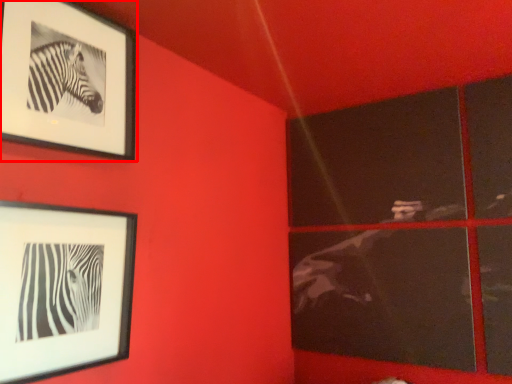
Question: From the image's perspective, what is the correct spatial positioning of picture frame (annotated by the red box) in reference to picture frame?

Choices:
 (A) above
 (B) below

Answer: (A)